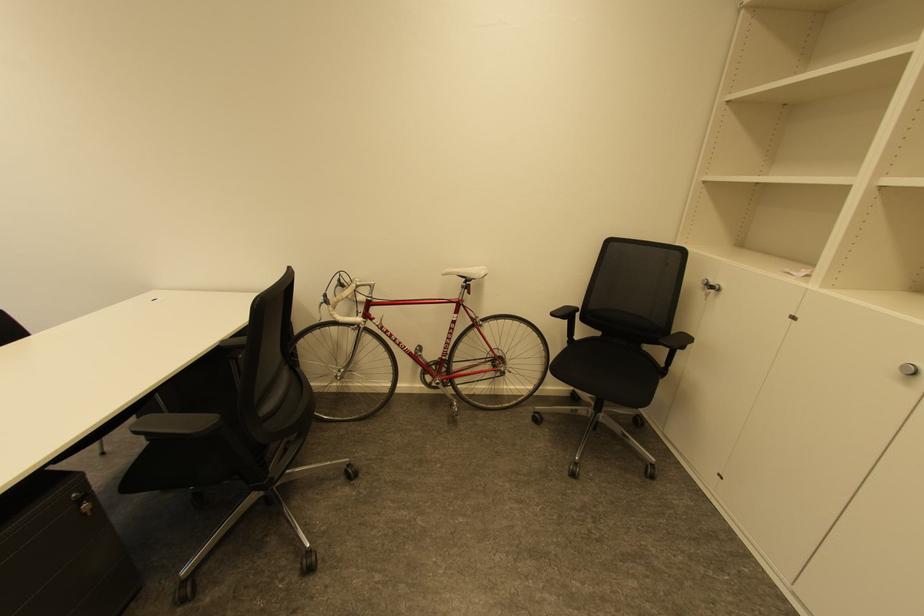
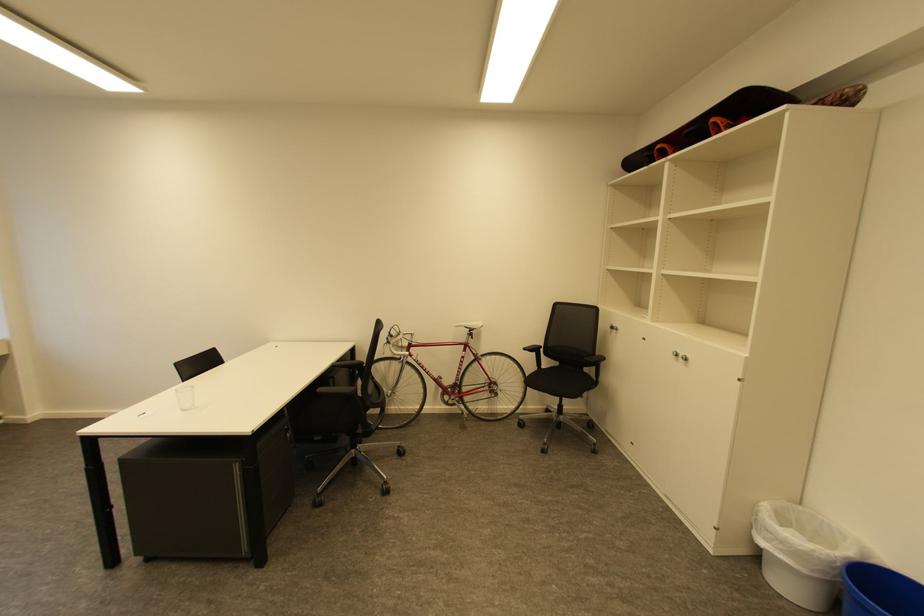
Where in the second image is the point corresponding to (560,315) from the first image?

(531, 350)